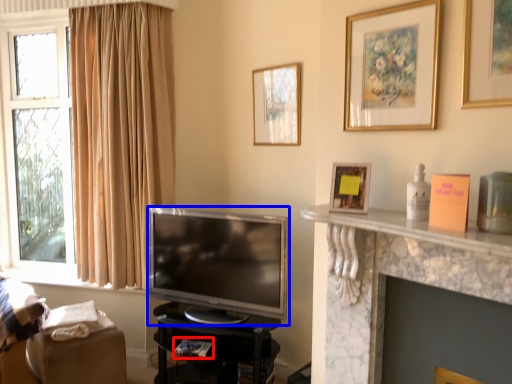
Question: Among these objects, which one is nearest to the camera, book (highlighted by a red box) or television (highlighted by a blue box)?

Choices:
 (A) book
 (B) television

Answer: (B)